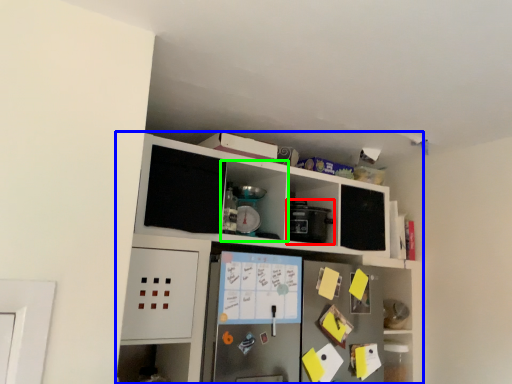
Question: Based on their relative distances, which object is farther from appliance (highlighted by a red box)? Choose from cabinetry (highlighted by a blue box) and cabinet (highlighted by a green box).

Choices:
 (A) cabinetry
 (B) cabinet

Answer: (A)